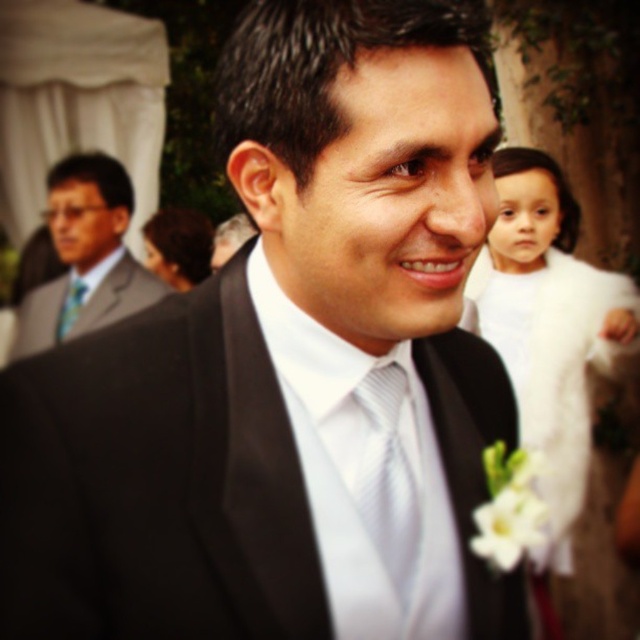
Question: Does white fluffy dress at right have a larger size compared to matte silver tie at center?

Choices:
 (A) yes
 (B) no

Answer: (A)

Question: Considering the real-world distances, which object is closest to the matte black tie at center?

Choices:
 (A) matte silver tie at center
 (B) white fluffy dress at right
 (C) matte black suit at left

Answer: (C)

Question: Which is farther from the white fluffy dress at right?

Choices:
 (A) matte black tie at center
 (B) matte silver tie at center
 (C) matte black suit at left

Answer: (A)

Question: Does matte black suit at left appear over matte silver tie at center?

Choices:
 (A) no
 (B) yes

Answer: (B)

Question: Which point is farther to the camera?

Choices:
 (A) (387, 451)
 (B) (67, 316)
 (C) (61, 298)

Answer: (C)

Question: Is white fluffy dress at right below matte black tie at center?

Choices:
 (A) yes
 (B) no

Answer: (A)